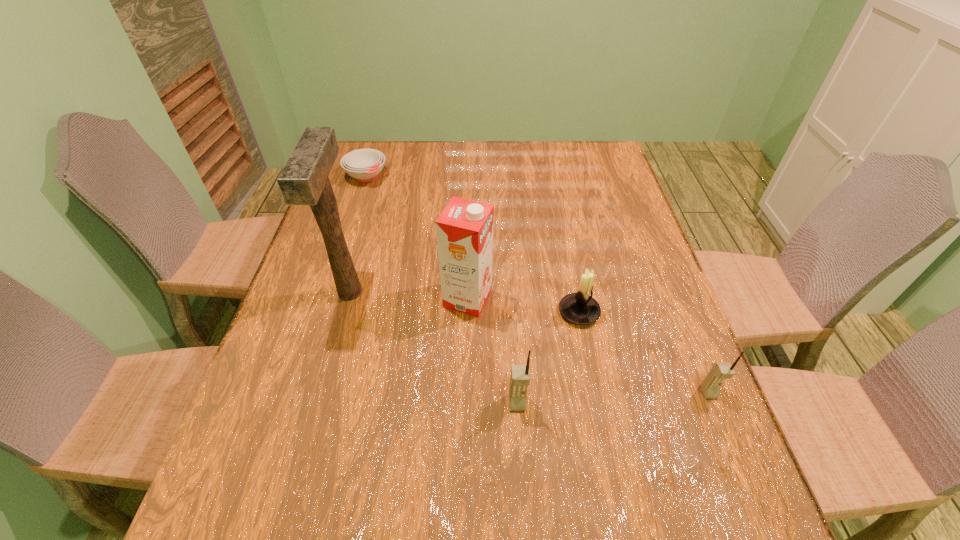
Image resolution: width=960 pixels, height=540 pixels. I want to click on free space between the shorter cellular telephone and the third tallest object, so click(x=612, y=397).

Find the location of `free area in between the left cellular telephone and the right cellular telephone`. free area in between the left cellular telephone and the right cellular telephone is located at coordinates (612, 397).

The height and width of the screenshot is (540, 960). I want to click on the second closest object to the farthest object, so click(464, 230).

Point out which object is positioned as the fourth nearest to the carton. Please provide its 2D coordinates. Your answer should be formatted as a tuple, i.e. [(x, y)], where the tuple contains the x and y coordinates of a point satisfying the conditions above.

[(364, 165)]

Identify the location of vacant point that satisfies the following two spatial constraints: 1. on the front side of the fourth object from right to left; 2. on the left side of the second object from right to left. The width and height of the screenshot is (960, 540). (468, 312).